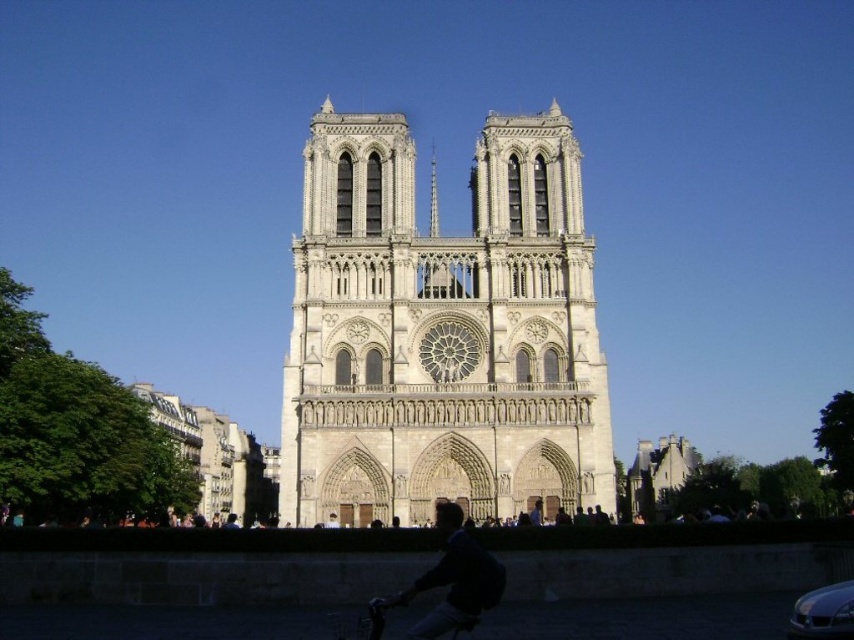
Question: Does beige stone cathedral at center have a smaller size compared to smooth stone spire at center?

Choices:
 (A) no
 (B) yes

Answer: (A)

Question: Does dark blue sweater at lower center have a lesser width compared to smooth stone spire at center?

Choices:
 (A) yes
 (B) no

Answer: (B)

Question: Is dark blue sweater at lower center below smooth stone spire at center?

Choices:
 (A) yes
 (B) no

Answer: (A)

Question: Considering the real-world distances, which object is farthest from the smooth stone spire at center?

Choices:
 (A) dark blue sweater at lower center
 (B) beige stone cathedral at center

Answer: (A)

Question: Which point is closer to the camera taking this photo?

Choices:
 (A) (516, 493)
 (B) (436, 205)
 (C) (445, 548)

Answer: (C)

Question: Which point is closer to the camera?

Choices:
 (A) dark blue sweater at lower center
 (B) smooth stone spire at center
 (C) beige stone cathedral at center

Answer: (A)